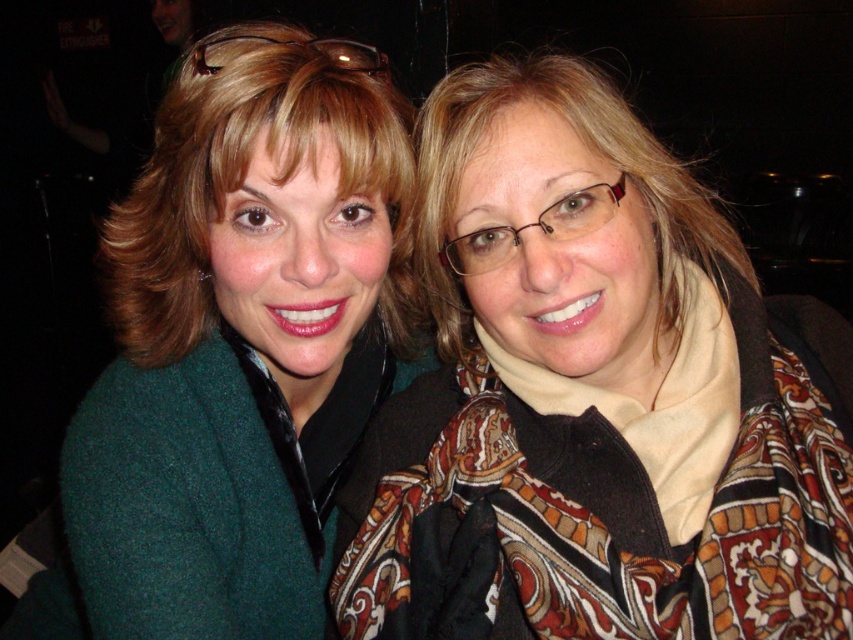
You are a photographer setting up for a portrait. You have a small rectangular frame that can only accommodate objects up to the size of the matte brown scarf at right. Can the green woolen sweater at upper left fit inside this frame?

The green woolen sweater at upper left is bigger than the matte brown scarf at right, so it cannot fit inside the frame designed for the scarf.